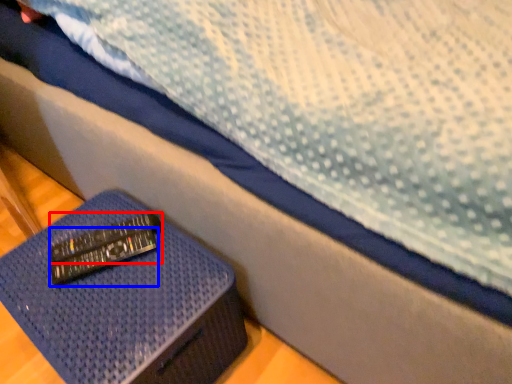
Question: Among these objects, which one is farthest to the camera, remote (highlighted by a red box) or remote (highlighted by a blue box)?

Choices:
 (A) remote
 (B) remote

Answer: (A)